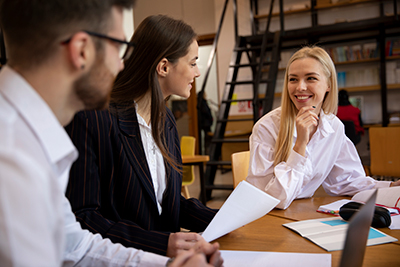
The width and height of the screenshot is (400, 267). I want to click on black metallic steps, so click(222, 187), click(225, 163), click(232, 140), click(237, 120), click(240, 99), click(244, 82), click(246, 65), click(249, 49).